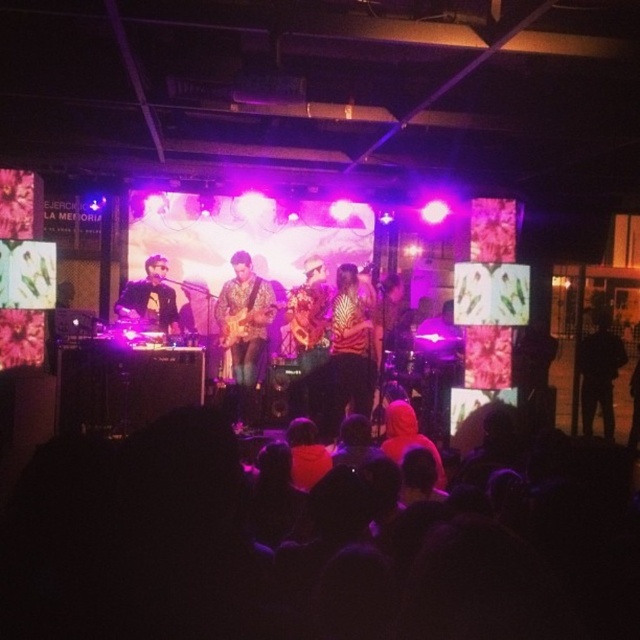
In the scene shown: You are a stagehand at the concert venue and need to hang a decorative banner exactly at the point with coordinates point (298, 552). According to the scene description, what object is located at that point?

The point (298, 552) corresponds to the black fabric at lower center.